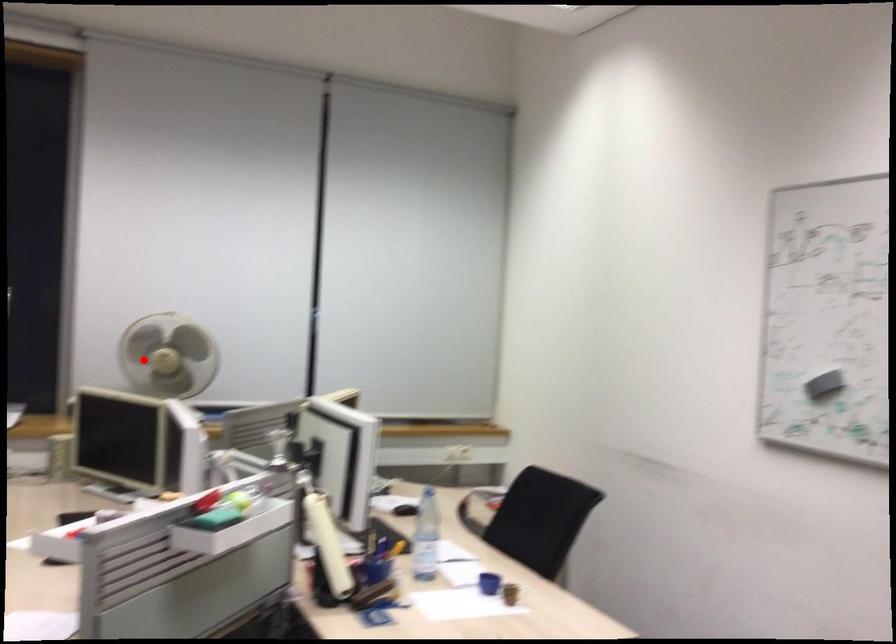
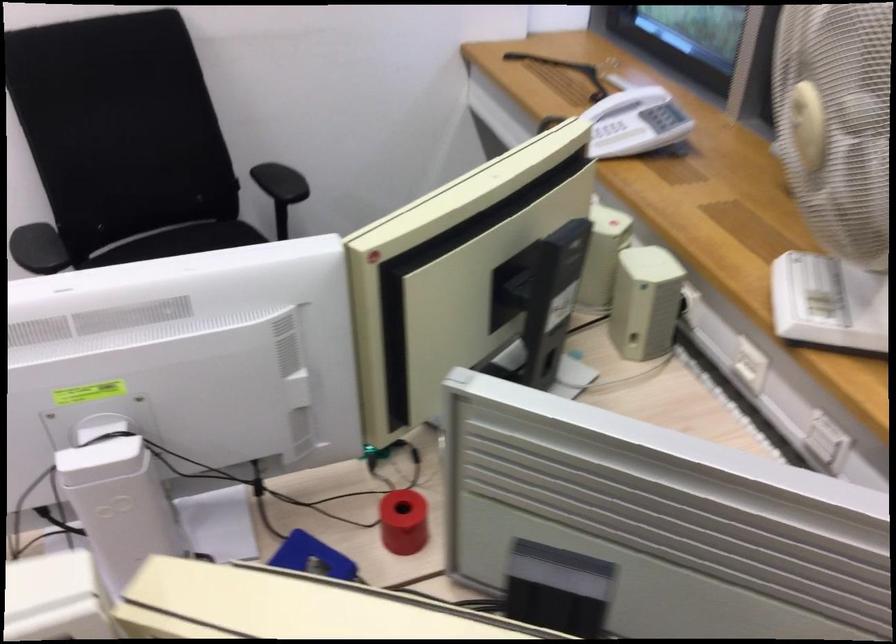
Find the pixel in the second image that matches the highlighted location in the first image.

(807, 125)